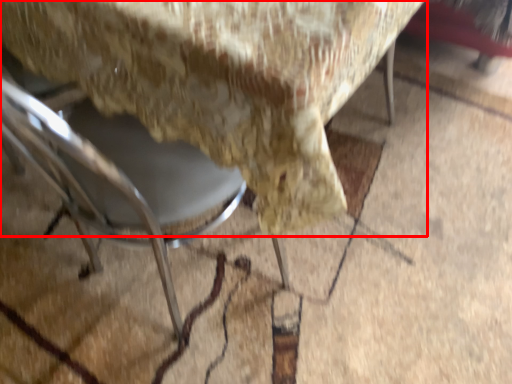
Question: In this image, where is chair (annotated by the red box) located relative to chair?

Choices:
 (A) right
 (B) left

Answer: (A)